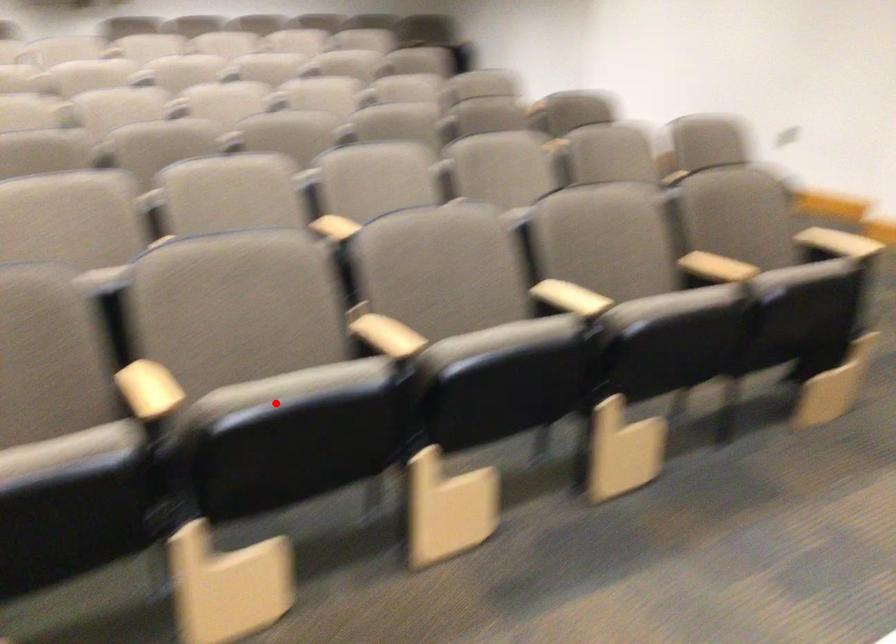
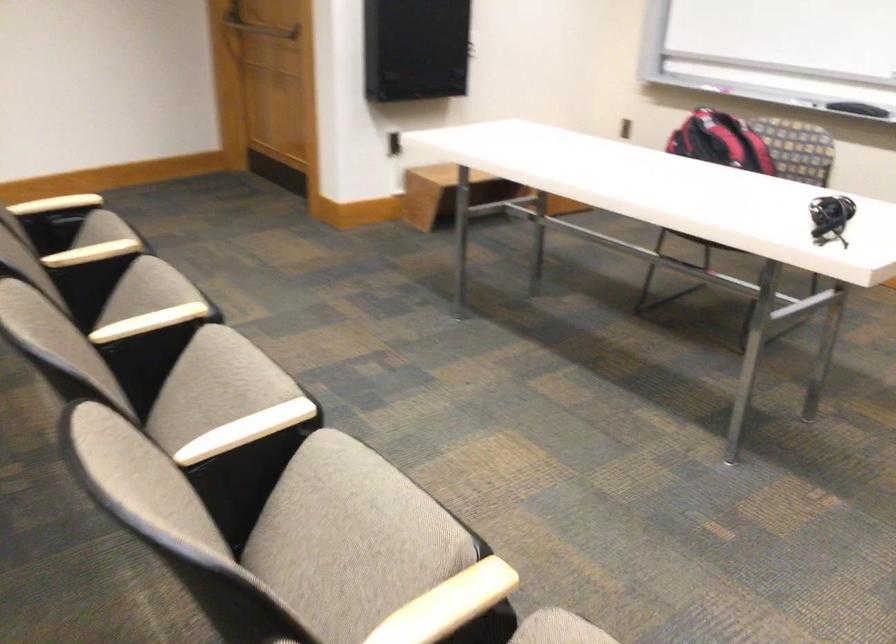
Locate, in the second image, the point that corresponds to the highlighted location in the first image.

(352, 531)